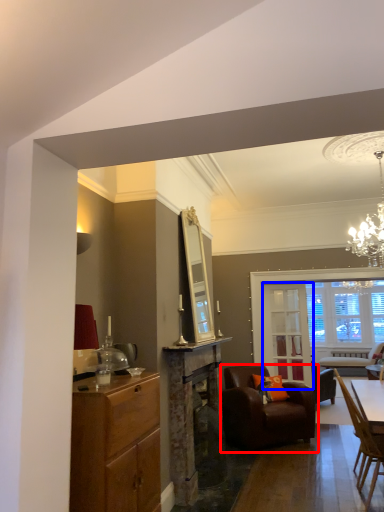
Question: Among these objects, which one is farthest to the camera, chair (highlighted by a red box) or glass door (highlighted by a blue box)?

Choices:
 (A) chair
 (B) glass door

Answer: (B)